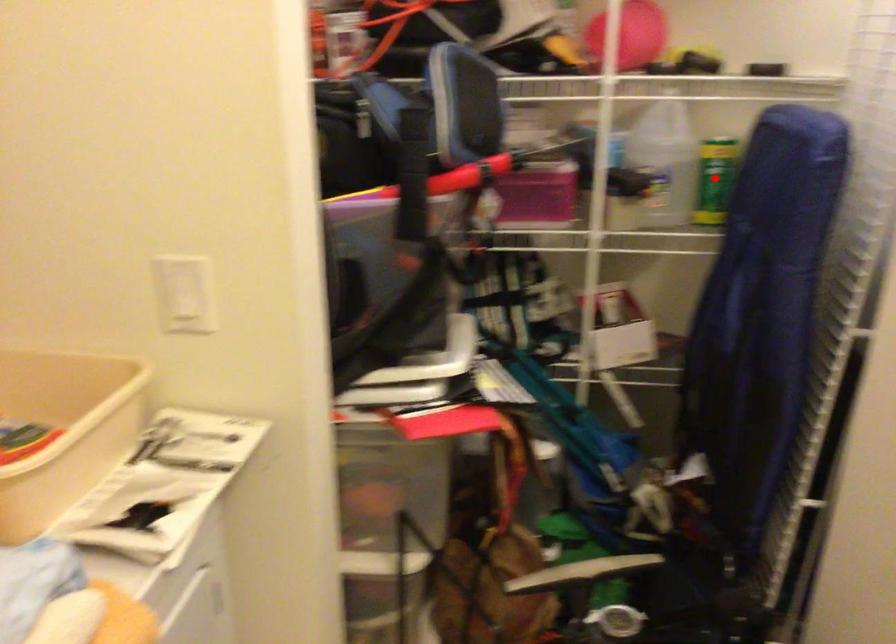
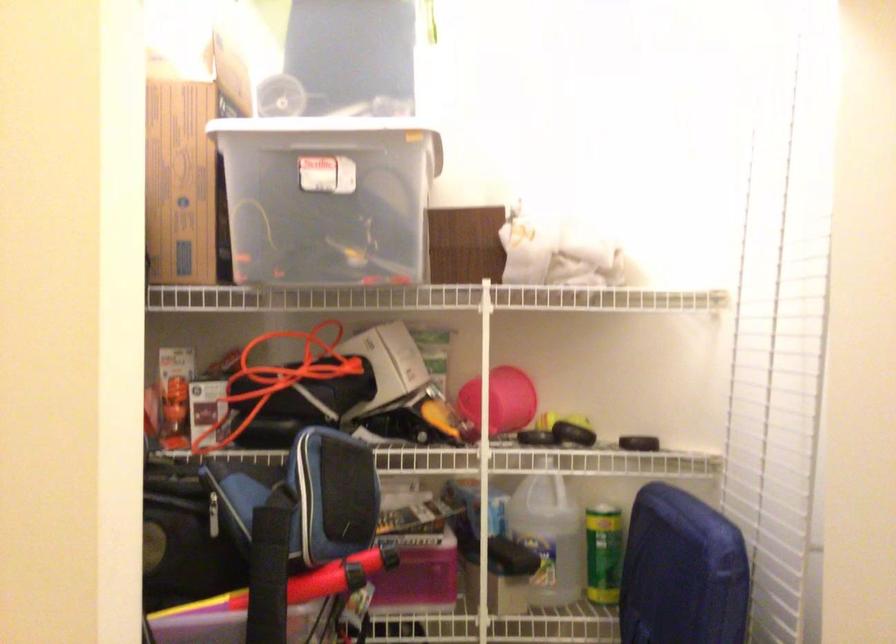
The point at the highlighted location is marked in the first image. Where is the corresponding point in the second image?

(604, 554)